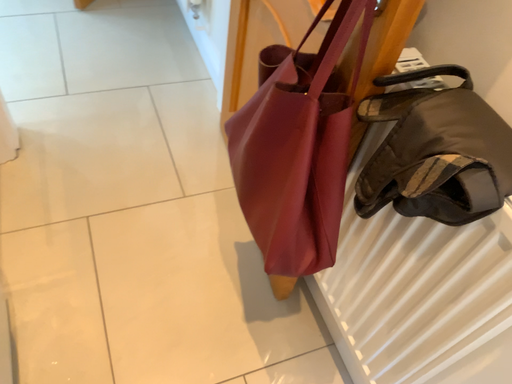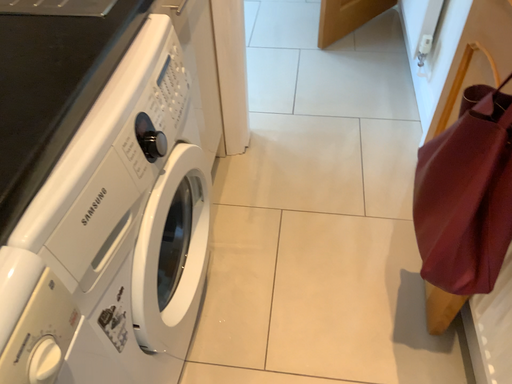
Question: How did the camera likely rotate when shooting the video?

Choices:
 (A) rotated right
 (B) rotated left

Answer: (B)